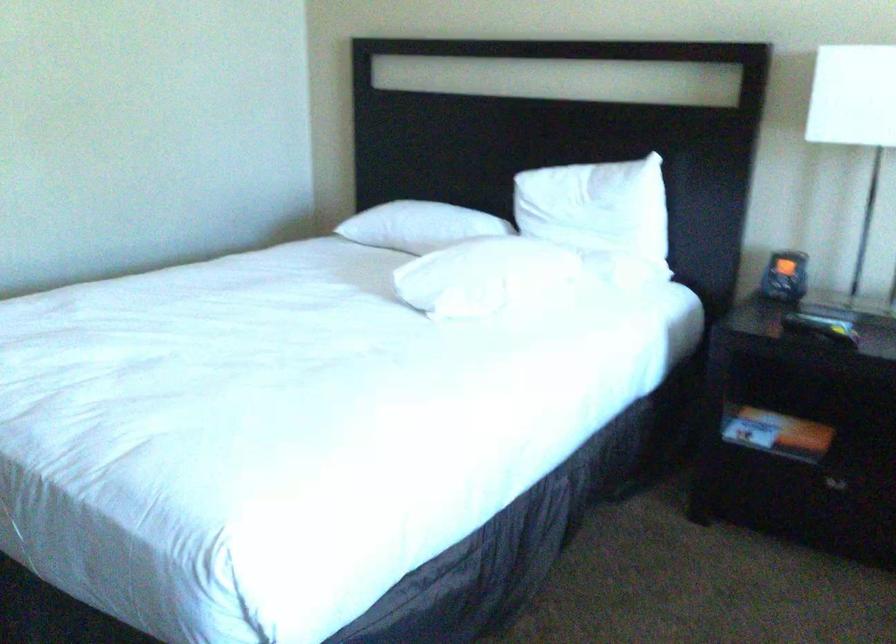
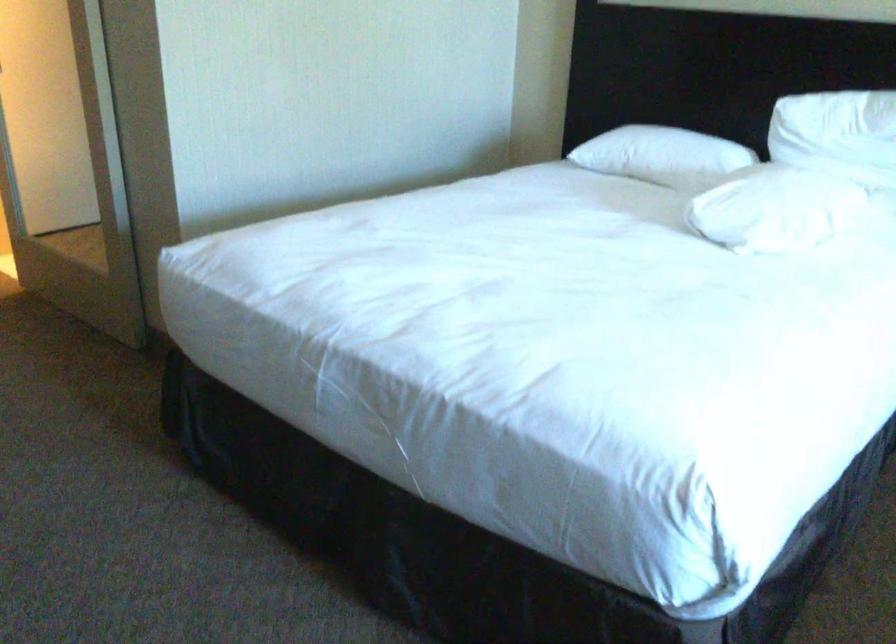
Question: The images are taken continuously from a first-person perspective. In which direction is your viewpoint rotating?

Choices:
 (A) Left
 (B) Right
 (C) Up
 (D) Down

Answer: (D)